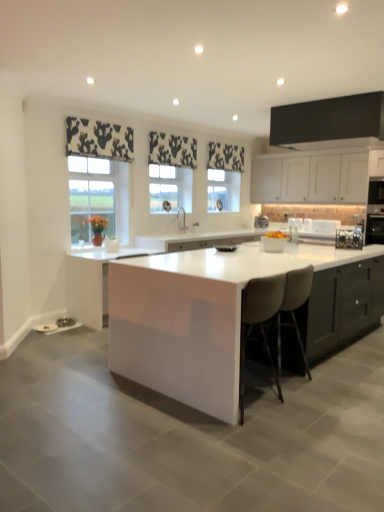
Question: From a real-world perspective, is white glossy cabinet at center, positioned as the 2th cabinetry in front-to-back order, positioned under white glossy bowl at center based on gravity?

Choices:
 (A) no
 (B) yes

Answer: (B)

Question: Are white glossy cabinet at center, positioned as the third cabinetry in right-to-left order, and white glossy bowl at center located far from each other?

Choices:
 (A) no
 (B) yes

Answer: (B)

Question: Is white glossy cabinet at center, which is the second cabinetry from back to front, not inside white glossy bowl at center?

Choices:
 (A) yes
 (B) no

Answer: (A)

Question: Does white glossy cabinet at center, positioned as the 2th cabinetry in front-to-back order, appear on the right side of white glossy bowl at center?

Choices:
 (A) yes
 (B) no

Answer: (B)

Question: Is white glossy cabinet at center, positioned as the 2th cabinetry in front-to-back order, in contact with white glossy bowl at center?

Choices:
 (A) yes
 (B) no

Answer: (B)

Question: Does point (228, 150) appear closer or farther from the camera than point (307, 281)?

Choices:
 (A) closer
 (B) farther

Answer: (B)

Question: In terms of height, does black printed fabric at upper center, the 3th curtain in the left-to-right sequence, look taller or shorter compared to beige fabric stool at center?

Choices:
 (A) tall
 (B) short

Answer: (B)

Question: Considering the positions of black printed fabric at upper center, which appears as the first curtain when viewed from the back, and beige fabric stool at center in the image, is black printed fabric at upper center, which appears as the first curtain when viewed from the back, wider or thinner than beige fabric stool at center?

Choices:
 (A) thin
 (B) wide

Answer: (A)

Question: Is black printed fabric at upper center, marked as the first curtain in a right-to-left arrangement, spatially inside beige fabric stool at center, or outside of it?

Choices:
 (A) outside
 (B) inside

Answer: (A)

Question: In terms of width, does white glossy sink at center look wider or thinner when compared to black and white fabric at upper left, the first curtain when ordered from front to back?

Choices:
 (A) wide
 (B) thin

Answer: (A)

Question: In the image, is white glossy sink at center positioned in front of or behind black and white fabric at upper left, positioned as the first curtain in left-to-right order?

Choices:
 (A) behind
 (B) front

Answer: (A)

Question: Considering the positions of point tap(182, 206) and point tap(132, 153), is point tap(182, 206) closer or farther from the camera than point tap(132, 153)?

Choices:
 (A) closer
 (B) farther

Answer: (B)

Question: Is white glossy sink at center bigger or smaller than black and white fabric at upper left, positioned as the first curtain in left-to-right order?

Choices:
 (A) big
 (B) small

Answer: (B)

Question: From their relative heights in the image, would you say clear glass window at center, the second window in the right-to-left sequence, is taller or shorter than white glossy table at center?

Choices:
 (A) tall
 (B) short

Answer: (B)

Question: From a real-world perspective, is clear glass window at center, the 1th window positioned from the left, physically located above or below white glossy table at center?

Choices:
 (A) above
 (B) below

Answer: (A)